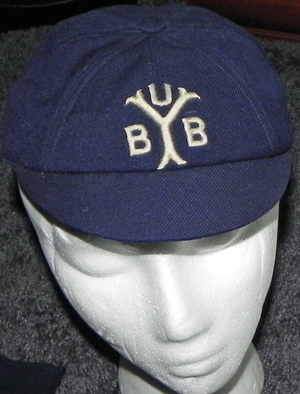
Find the location of a particular element. styrofoam wig head is located at coordinates (235, 293), (118, 318).